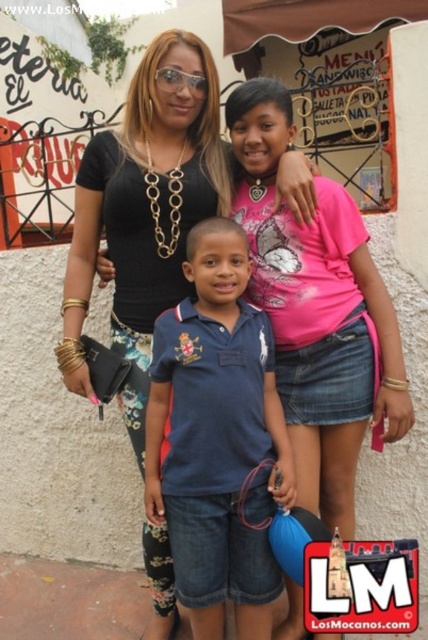
Question: Is the position of blue cotton polo shirt at center less distant than that of pink matte shirt at center?

Choices:
 (A) no
 (B) yes

Answer: (B)

Question: Among these objects, which one is nearest to the camera?

Choices:
 (A) black matte shirt at center
 (B) pink matte shirt at center

Answer: (B)

Question: Does pink matte shirt at center appear on the left side of black matte shirt at center?

Choices:
 (A) yes
 (B) no

Answer: (B)

Question: Which point appears farthest from the camera in this image?

Choices:
 (A) (187, 419)
 (B) (336, 312)
 (C) (88, 372)

Answer: (C)

Question: Is blue cotton polo shirt at center in front of black matte shirt at center?

Choices:
 (A) yes
 (B) no

Answer: (A)

Question: Which point is farther from the camera taking this photo?

Choices:
 (A) (130, 202)
 (B) (288, 122)
 (C) (205, 362)

Answer: (B)